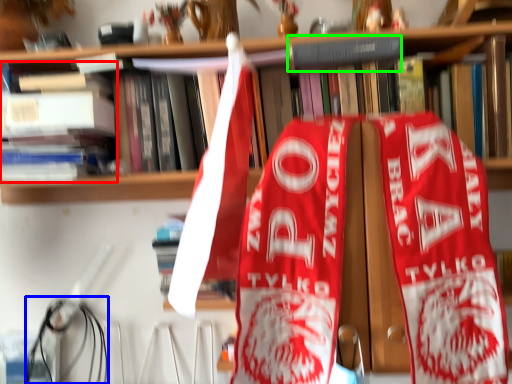
Question: Which is nearer to the book (highlighted by a red box)? wire (highlighted by a blue box) or book (highlighted by a green box).

Choices:
 (A) wire
 (B) book

Answer: (A)